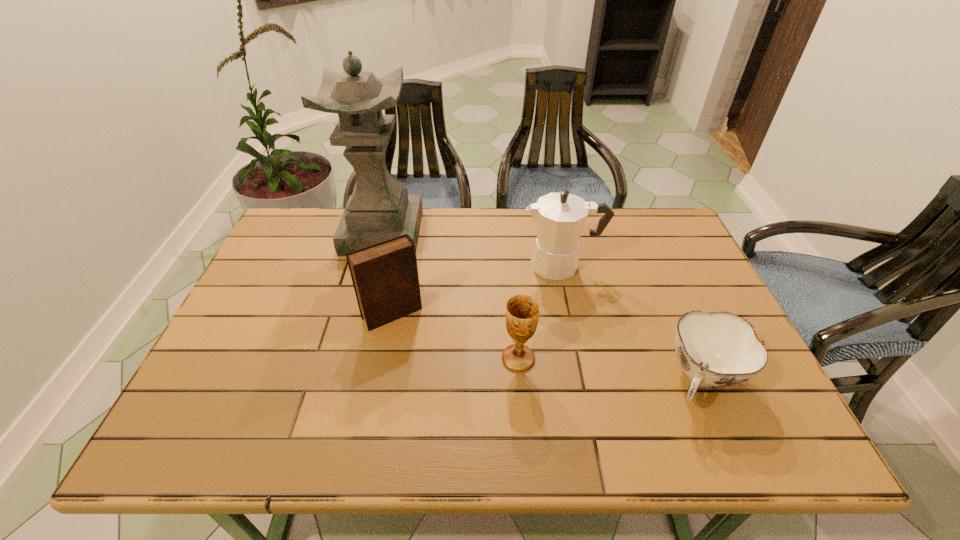
Image resolution: width=960 pixels, height=540 pixels. I want to click on the tallest object, so click(379, 209).

Identify the location of coffeepot. The height and width of the screenshot is (540, 960). (559, 217).

Where is `the third nearest object`? The height and width of the screenshot is (540, 960). the third nearest object is located at coordinates (385, 277).

This screenshot has height=540, width=960. Find the location of `chalice`. chalice is located at coordinates (522, 311).

Where is `the shortest object`? the shortest object is located at coordinates (719, 349).

Where is `chinaware`? The height and width of the screenshot is (540, 960). chinaware is located at coordinates (719, 349).

Image resolution: width=960 pixels, height=540 pixels. Find the location of `free space located at the front opening of the sculpture`. free space located at the front opening of the sculpture is located at coordinates (360, 320).

Locate an element on the screen. free space located 0.320m at the spout of the coffeepot is located at coordinates (412, 265).

Identify the location of vacant point located 0.090m at the spout of the coffeepot. (491, 265).

The image size is (960, 540). I want to click on blank space located 0.110m at the spout of the coffeepot, so click(x=484, y=265).